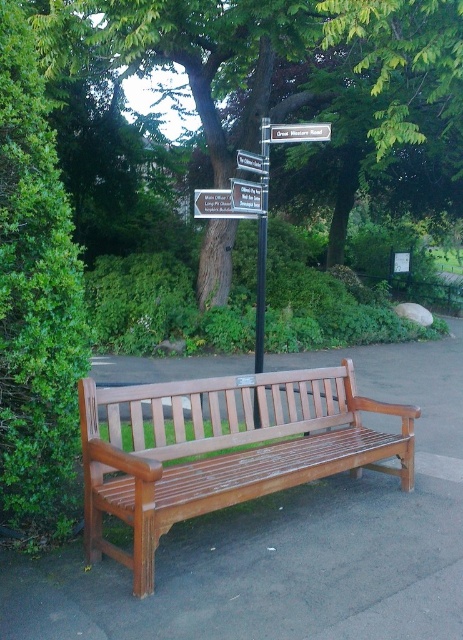
Question: Which object is the farthest from the white plastic sign at upper center?

Choices:
 (A) white plastic street sign at upper center
 (B) metallic signpost at center
 (C) green leafy tree at center

Answer: (C)

Question: Can you confirm if polished wood bench at center is positioned below metallic signpost at center?

Choices:
 (A) no
 (B) yes

Answer: (B)

Question: Does polished wood bench at center have a greater width compared to metallic signpost at center?

Choices:
 (A) no
 (B) yes

Answer: (B)

Question: Does green leafy tree at center come behind green leafy bush at left?

Choices:
 (A) yes
 (B) no

Answer: (A)

Question: Estimate the real-world distances between objects in this image. Which object is farther from the green leafy bush at left?

Choices:
 (A) polished wood bench at center
 (B) metallic signpost at center
 (C) white plastic sign at upper center

Answer: (B)

Question: Which object appears closest to the camera in this image?

Choices:
 (A) green leafy tree at center
 (B) white plastic street sign at upper center

Answer: (B)